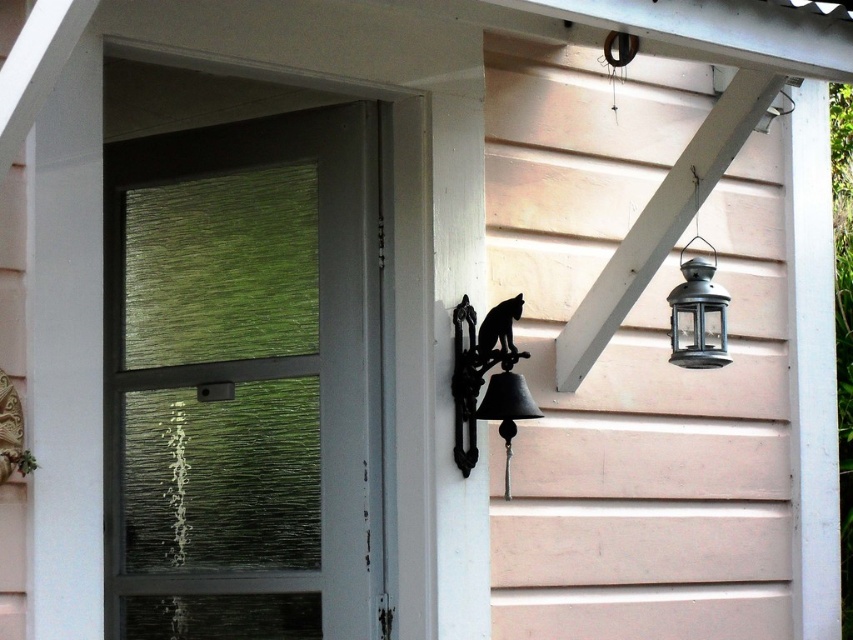
You are standing on the porch and want to ring the bell. Which object is closer to you, the green frosted glass window at left or the black wrought iron bell at center?

The green frosted glass window at left is closer to you than the black wrought iron bell at center.

In the scene shown: You are a window installer assessing the porch. The green frosted glass window at left and the metallic lantern at upper right need to be replaced. Which object requires a wider replacement piece?

The green frosted glass window at left requires a wider replacement piece because its width surpasses that of the metallic lantern at upper right.

You are standing in front of the house and want to take a photo of the green frosted glass window at left. Your camera is 4.39 meters away from the window. Is the camera close enough to capture the entire window in one shot?

The green frosted glass window at left and camera are 4.39 meters apart, so the camera is exactly at the required distance to capture the entire window in one shot.